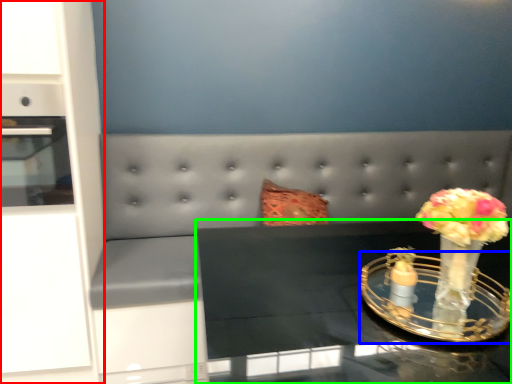
Question: Based on their relative distances, which object is farther from dresser (highlighted by a red box)? Choose from candle holder (highlighted by a blue box) and table (highlighted by a green box).

Choices:
 (A) candle holder
 (B) table

Answer: (A)